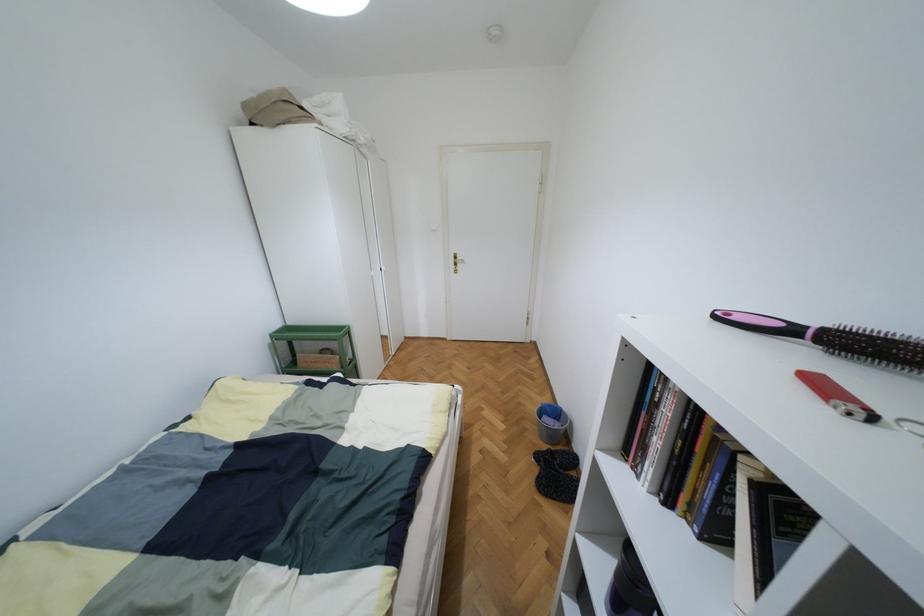
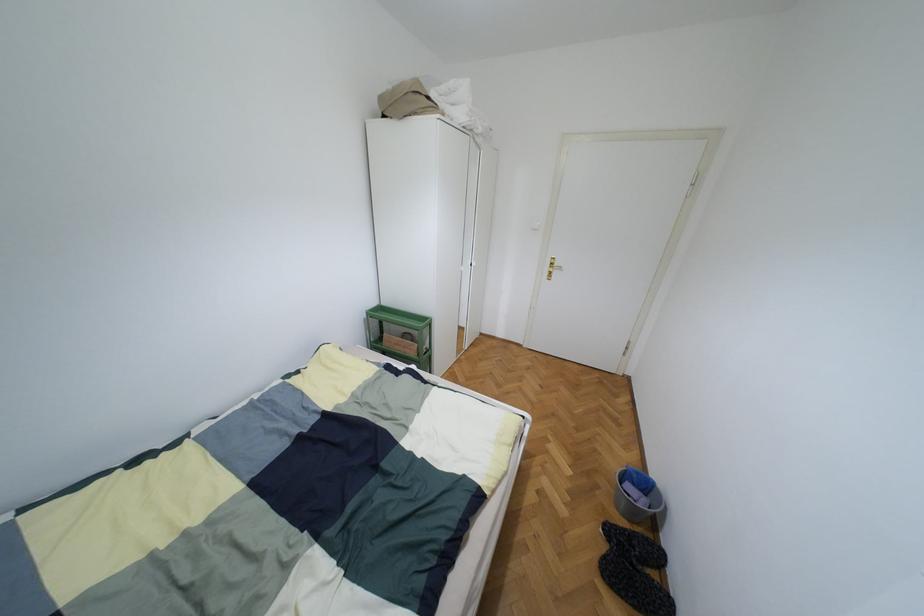
Locate, in the second image, the point that corresponds to pixel 462 261 in the first image.

(560, 267)